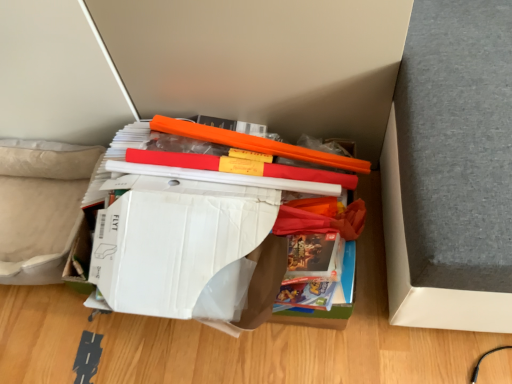
Where is `orange plastic ruler at center`? This screenshot has height=384, width=512. orange plastic ruler at center is located at coordinates (245, 168).

Can you see white cardboard box at center, which ranks as the second paperback book in front-to-back order, touching white cardboard box at center, which ranks as the second paperback book in back-to-front order?

Yes, white cardboard box at center, which ranks as the second paperback book in front-to-back order, and white cardboard box at center, which ranks as the second paperback book in back-to-front order, clearly make contact.

Considering the sizes of white cardboard box at center, which is counted as the 1th paperback book, starting from the back, and white cardboard box at center, positioned as the first paperback book in front-to-back order, in the image, is white cardboard box at center, which is counted as the 1th paperback book, starting from the back, wider or thinner than white cardboard box at center, positioned as the first paperback book in front-to-back order,?

white cardboard box at center, which is counted as the 1th paperback book, starting from the back, is wider than white cardboard box at center, positioned as the first paperback book in front-to-back order.

From the image's perspective, which one is positioned higher, white cardboard box at center, which ranks as the second paperback book in front-to-back order, or white cardboard box at center, positioned as the first paperback book in front-to-back order?

white cardboard box at center, which ranks as the second paperback book in front-to-back order, is shown above in the image.

Is white cardboard box at center, which ranks as the second paperback book in back-to-front order, aimed at orange plastic ruler at center?

No, white cardboard box at center, which ranks as the second paperback book in back-to-front order, is not aimed at orange plastic ruler at center.

Considering the sizes of white cardboard box at center, which ranks as the second paperback book in back-to-front order, and orange plastic ruler at center in the image, is white cardboard box at center, which ranks as the second paperback book in back-to-front order, taller or shorter than orange plastic ruler at center?

white cardboard box at center, which ranks as the second paperback book in back-to-front order, is taller than orange plastic ruler at center.

In the image, is white cardboard box at center, which ranks as the second paperback book in back-to-front order, on the left side or the right side of orange plastic ruler at center?

From the image, it's evident that white cardboard box at center, which ranks as the second paperback book in back-to-front order, is to the left of orange plastic ruler at center.

Measure the distance between white cardboard box at center, which ranks as the second paperback book in back-to-front order, and orange plastic ruler at center.

They are 5.64 inches apart.

Which object is thinner, orange plastic ruler at center or white cardboard box at center, which is counted as the 1th paperback book, starting from the back?

Thinner between the two is orange plastic ruler at center.

Is orange plastic ruler at center bigger or smaller than white cardboard box at center, which ranks as the second paperback book in front-to-back order?

Considering their sizes, orange plastic ruler at center takes up less space than white cardboard box at center, which ranks as the second paperback book in front-to-back order.

Does orange plastic ruler at center appear on the right side of white cardboard box at center, which is counted as the 1th paperback book, starting from the back?

Correct, you'll find orange plastic ruler at center to the right of white cardboard box at center, which is counted as the 1th paperback book, starting from the back.

Would you consider white cardboard box at center, which ranks as the second paperback book in front-to-back order, to be distant from orange plastic ruler at center?

white cardboard box at center, which ranks as the second paperback book in front-to-back order, is near orange plastic ruler at center, not far away.

From a real-world perspective, is white cardboard box at center, which ranks as the second paperback book in front-to-back order, positioned above or below orange plastic ruler at center?

white cardboard box at center, which ranks as the second paperback book in front-to-back order, is situated lower than orange plastic ruler at center in the real world.

Is white cardboard box at center, which is counted as the 1th paperback book, starting from the back, positioned with its back to orange plastic ruler at center?

That's not correct — white cardboard box at center, which is counted as the 1th paperback book, starting from the back, is not looking away from orange plastic ruler at center.

Can you confirm if white cardboard box at center, which is counted as the 1th paperback book, starting from the back, is shorter than orange plastic ruler at center?

No.

Is white cardboard box at center, which ranks as the second paperback book in back-to-front order, taller than white cardboard box at center, which ranks as the second paperback book in front-to-back order?

No, white cardboard box at center, which ranks as the second paperback book in back-to-front order, is not taller than white cardboard box at center, which ranks as the second paperback book in front-to-back order.

Based on the photo, what's the angular difference between white cardboard box at center, which ranks as the second paperback book in back-to-front order, and white cardboard box at center, which ranks as the second paperback book in front-to-back order,'s facing directions?

The facing directions of white cardboard box at center, which ranks as the second paperback book in back-to-front order, and white cardboard box at center, which ranks as the second paperback book in front-to-back order, are 0.102 degrees apart.

You are a GUI agent. You are given a task and a screenshot of the screen. Output one action in this format:
    pyautogui.click(x=<x>, y=<y>)
    Task: Click on the paperback book in front of the white cardboard box at center, which ranks as the second paperback book in front-to-back order
    This screenshot has height=384, width=512.
    Given the screenshot: What is the action you would take?
    pyautogui.click(x=180, y=246)

Are white cardboard box at center, which ranks as the second paperback book in back-to-front order, and white cardboard box at center, which is counted as the 1th paperback book, starting from the back, beside each other?

Yes, white cardboard box at center, which ranks as the second paperback book in back-to-front order, and white cardboard box at center, which is counted as the 1th paperback book, starting from the back, clearly make contact.

At what (x,y) coordinates should I click in order to perform the action: click on the 2nd paperback book in front of the orange plastic ruler at center, counting from the anchor's position. Please return your answer as a coordinate pair (x, y). The height and width of the screenshot is (384, 512). Looking at the image, I should click on (180, 246).

Considering the relative sizes of orange plastic ruler at center and white cardboard box at center, positioned as the first paperback book in front-to-back order, in the image provided, is orange plastic ruler at center taller than white cardboard box at center, positioned as the first paperback book in front-to-back order,?

In fact, orange plastic ruler at center may be shorter than white cardboard box at center, positioned as the first paperback book in front-to-back order.

Between orange plastic ruler at center and white cardboard box at center, positioned as the first paperback book in front-to-back order, which one appears on the right side from the viewer's perspective?

orange plastic ruler at center is more to the right.

Considering the sizes of objects orange plastic ruler at center and white cardboard box at center, positioned as the first paperback book in front-to-back order, in the image provided, who is bigger, orange plastic ruler at center or white cardboard box at center, positioned as the first paperback book in front-to-back order,?

Bigger between the two is white cardboard box at center, positioned as the first paperback book in front-to-back order.

Identify the location of paperback book behind the white cardboard box at center, positioned as the first paperback book in front-to-back order. (187, 248).

Image resolution: width=512 pixels, height=384 pixels. I want to click on the 1st paperback book directly beneath the orange plastic ruler at center (from a real-world perspective), so click(180, 246).

When comparing their distances from white cardboard box at center, which ranks as the second paperback book in front-to-back order, does white cardboard box at center, positioned as the first paperback book in front-to-back order, or orange plastic ruler at center seem further?

Based on the image, orange plastic ruler at center appears to be further to white cardboard box at center, which ranks as the second paperback book in front-to-back order.

In the scene shown: Looking at the image, which one is located further to white cardboard box at center, which ranks as the second paperback book in front-to-back order, orange plastic ruler at center or white cardboard box at center, which ranks as the second paperback book in back-to-front order?

orange plastic ruler at center is positioned further to the anchor white cardboard box at center, which ranks as the second paperback book in front-to-back order.

Consider the image. Based on their spatial positions, is white cardboard box at center, which ranks as the second paperback book in front-to-back order, or orange plastic ruler at center closer to white cardboard box at center, which ranks as the second paperback book in back-to-front order?

Based on the image, white cardboard box at center, which ranks as the second paperback book in front-to-back order, appears to be nearer to white cardboard box at center, which ranks as the second paperback book in back-to-front order.

Estimate the real-world distances between objects in this image. Which object is further from white cardboard box at center, positioned as the first paperback book in front-to-back order, orange plastic ruler at center or white cardboard box at center, which is counted as the 1th paperback book, starting from the back?

orange plastic ruler at center lies further to white cardboard box at center, positioned as the first paperback book in front-to-back order, than the other object.

From the picture: Estimate the real-world distances between objects in this image. Which object is further from orange plastic ruler at center, white cardboard box at center, positioned as the first paperback book in front-to-back order, or white cardboard box at center, which is counted as the 1th paperback book, starting from the back?

white cardboard box at center, positioned as the first paperback book in front-to-back order.

From the image, which object appears to be nearer to orange plastic ruler at center, white cardboard box at center, which is counted as the 1th paperback book, starting from the back, or white cardboard box at center, which ranks as the second paperback book in back-to-front order?

white cardboard box at center, which is counted as the 1th paperback book, starting from the back.

Locate an element on the screen. The width and height of the screenshot is (512, 384). paperback book between orange plastic ruler at center and white cardboard box at center, which ranks as the second paperback book in back-to-front order, in the vertical direction is located at coordinates (x=187, y=248).